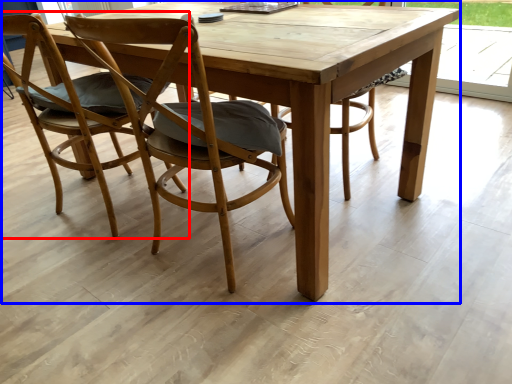
Question: Which of the following is the closest to the observer, chair (highlighted by a red box) or picnic table (highlighted by a blue box)?

Choices:
 (A) chair
 (B) picnic table

Answer: (B)